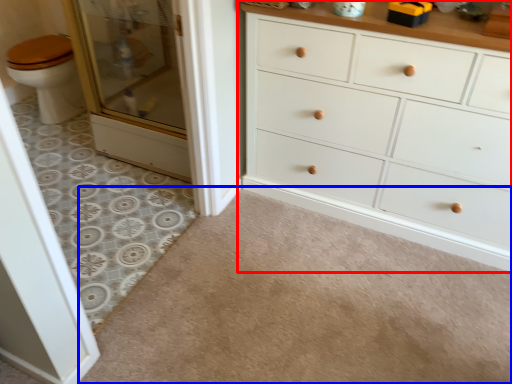
Question: Among these objects, which one is nearest to the camera, chest of drawers (highlighted by a red box) or plain (highlighted by a blue box)?

Choices:
 (A) chest of drawers
 (B) plain

Answer: (B)